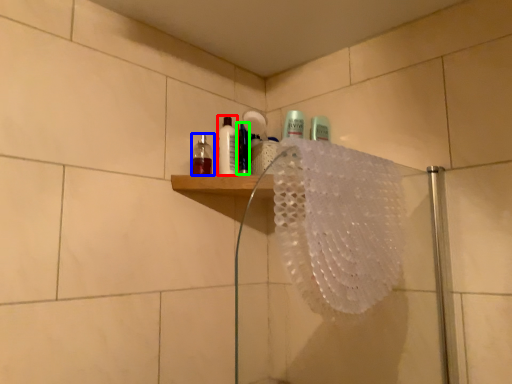
Question: Which is farther away from mouthwash (highlighted by a red box)? mouthwash (highlighted by a blue box) or mouthwash (highlighted by a green box)?

Choices:
 (A) mouthwash
 (B) mouthwash

Answer: (A)